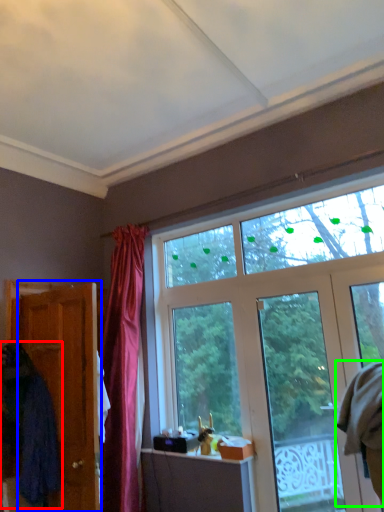
Question: Which is farther away from robe (highlighted by a red box)? door (highlighted by a blue box) or robe (highlighted by a green box)?

Choices:
 (A) door
 (B) robe

Answer: (B)